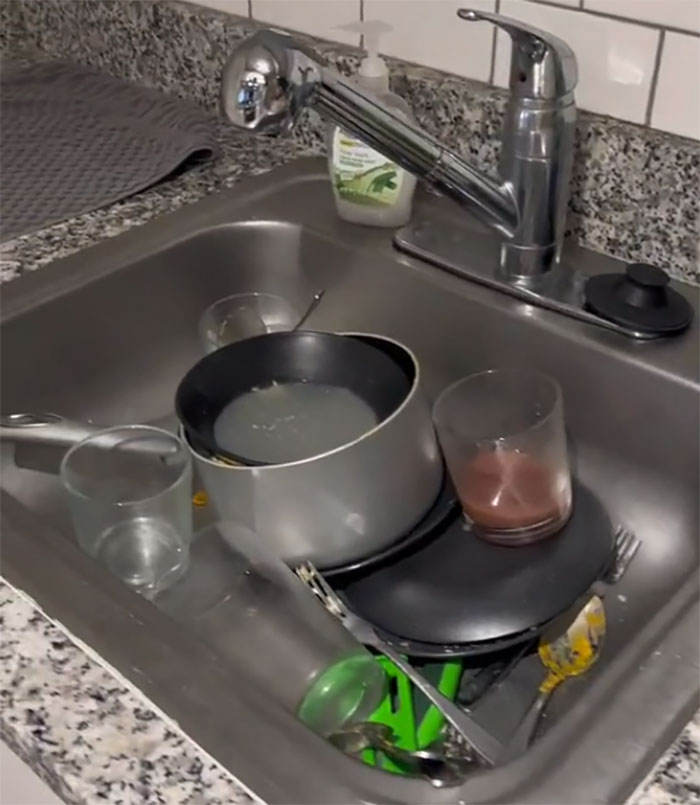
The width and height of the screenshot is (700, 805). I want to click on bowl, so click(217, 374).